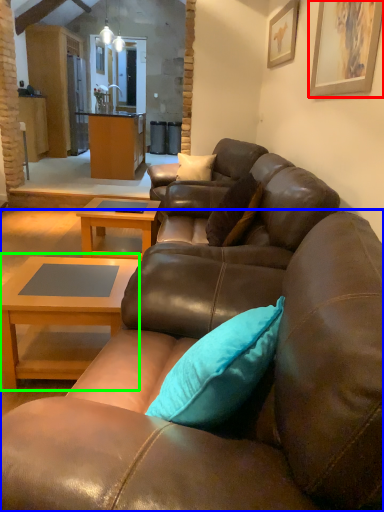
Question: Which object is positioned closest to picture frame (highlighted by a red box)? Select from studio couch (highlighted by a blue box) and coffee table (highlighted by a green box).

Choices:
 (A) studio couch
 (B) coffee table

Answer: (A)